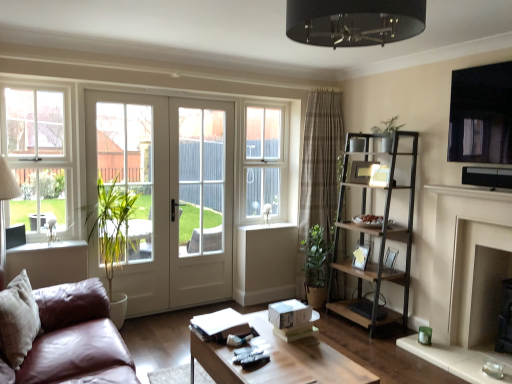
What are the coordinates of `matte black tv at upper right` in the screenshot? It's located at (481, 114).

This screenshot has height=384, width=512. Describe the element at coordinates (262, 161) in the screenshot. I see `white wood window at center, the 1th window when ordered from right to left` at that location.

Describe the element at coordinates (390, 258) in the screenshot. I see `matte black picture frame at right` at that location.

Measure the distance between matte black picture frame at right and camera.

matte black picture frame at right and camera are 3.85 meters apart.

The width and height of the screenshot is (512, 384). What do you see at coordinates (168, 194) in the screenshot?
I see `white glossy door at center` at bounding box center [168, 194].

This screenshot has height=384, width=512. I want to click on brown textured curtain at center, so click(320, 162).

From a real-world perspective, between brown textured curtain at center and matte black picture frame at right, who is vertically higher?

brown textured curtain at center.

Is brown textured curtain at center positioned with its back to matte black picture frame at right?

No.

Looking at the image, does brown textured curtain at center seem bigger or smaller compared to matte black picture frame at right?

In the image, brown textured curtain at center appears to be larger than matte black picture frame at right.

How far apart are brown textured curtain at center and matte black picture frame at right?

They are 3.54 feet apart.

Can you tell me how much matte black picture frame at right and brown textured curtain at center differ in facing direction?

The angle between the facing direction of matte black picture frame at right and the facing direction of brown textured curtain at center is 103 degrees.

Does matte black picture frame at right appear on the right side of brown textured curtain at center?

Yes.

Is point (383, 265) closer or farther from the camera than point (308, 184)?

Point (383, 265) appears to be closer to the viewer than point (308, 184).

From the picture: From the image's perspective, which is below, matte black picture frame at right or brown textured curtain at center?

matte black picture frame at right appears lower in the image.

Considering the relative sizes of green matte plant at upper right and matte black tv at upper right in the image provided, is green matte plant at upper right wider than matte black tv at upper right?

Yes.

Considering the positions of objects green matte plant at upper right and matte black tv at upper right in the image provided, who is in front, green matte plant at upper right or matte black tv at upper right?

matte black tv at upper right is more forward.

In the scene shown: Which of these two, green matte plant at upper right or matte black tv at upper right, is smaller?

green matte plant at upper right is smaller.

From the picture: Is wooden coffee table at center aimed at white wood window at center, marked as the 2th window in a front-to-back arrangement?

No, wooden coffee table at center is not oriented towards white wood window at center, marked as the 2th window in a front-to-back arrangement.

Is wooden coffee table at center smaller than white wood window at center, marked as the first window in a back-to-front arrangement?

Incorrect, wooden coffee table at center is not smaller in size than white wood window at center, marked as the first window in a back-to-front arrangement.

What are the coordinates of `the 2nd window behind the wooden coffee table at center, counting from the anchor's position` in the screenshot? It's located at (262, 161).

Does white glossy door at center have a lesser height compared to white wood window at center, marked as the 2th window in a front-to-back arrangement?

No, white glossy door at center is not shorter than white wood window at center, marked as the 2th window in a front-to-back arrangement.

Is white glossy door at center not within white wood window at center, marked as the first window in a back-to-front arrangement?

Yes, white glossy door at center is not within white wood window at center, marked as the first window in a back-to-front arrangement.

This screenshot has height=384, width=512. In order to click on door below the white wood window at center, which ranks as the 2th window in left-to-right order (from the image's perspective) in this screenshot , I will do `click(168, 194)`.

Considering the sizes of objects white wood window at center, the 1th window when ordered from right to left, and white matte fireplace at right in the image provided, who is thinner, white wood window at center, the 1th window when ordered from right to left, or white matte fireplace at right?

white matte fireplace at right.

Is white wood window at center, marked as the first window in a back-to-front arrangement, oriented towards white matte fireplace at right?

Yes, white wood window at center, marked as the first window in a back-to-front arrangement, is oriented towards white matte fireplace at right.

Does white wood window at center, marked as the first window in a back-to-front arrangement, have a lesser height compared to white matte fireplace at right?

Incorrect, the height of white wood window at center, marked as the first window in a back-to-front arrangement, does not fall short of that of white matte fireplace at right.

From a real-world perspective, is white wood window at center, which ranks as the 2th window in left-to-right order, physically below white matte fireplace at right?

No, from a real-world perspective, white wood window at center, which ranks as the 2th window in left-to-right order, is not below white matte fireplace at right.

The width and height of the screenshot is (512, 384). What are the coordinates of `picture frame that appears in front of the white glossy screen door at center` in the screenshot? It's located at (390, 258).

Could you tell me if matte black picture frame at right is turned towards white glossy screen door at center?

No, matte black picture frame at right is not facing towards white glossy screen door at center.

From the picture: Would you say matte black picture frame at right is outside white glossy screen door at center?

Yes, matte black picture frame at right is outside of white glossy screen door at center.

Between matte black picture frame at right and white glossy screen door at center, which one appears on the right side from the viewer's perspective?

Positioned to the right is matte black picture frame at right.

This screenshot has width=512, height=384. In order to click on picture frame below the brown textured curtain at center (from the image's perspective) in this screenshot , I will do `click(390, 258)`.

I want to click on curtain lying behind the matte black picture frame at right, so click(x=320, y=162).

Based on their spatial positions, is wooden coffee table at center or green matte plant at upper right closer to matte black tv at upper right?

green matte plant at upper right.

Considering their positions, is matte black tv at upper right positioned closer to white glossy door at center than beige fabric pillow at lower left?

beige fabric pillow at lower left is positioned closer to the anchor white glossy door at center.

When comparing their distances from white matte fireplace at right, does matte black tv at upper right or brown wood/black metal shelf at right seem closer?

The object closer to white matte fireplace at right is brown wood/black metal shelf at right.

Looking at the image, which one is located closer to white glossy screen door at center, brown textured curtain at center or matte black tv at upper right?

Among the two, brown textured curtain at center is located nearer to white glossy screen door at center.

Estimate the real-world distances between objects in this image. Which object is further from green matte plant at upper right, brown wood/black metal shelf at right or white glossy screen door at center?

white glossy screen door at center lies further to green matte plant at upper right than the other object.

Which object lies nearer to the anchor point green matte plant at upper right, white glossy door at center or white glossy screen door at center?

white glossy screen door at center is closer to green matte plant at upper right.

Estimate the real-world distances between objects in this image. Which object is further from matte black tv at upper right, beige fabric pillow at lower left or white glossy screen door at center?

beige fabric pillow at lower left.

Which object lies further to the anchor point green matte plant at upper right, white wood window at upper left, which is the first window from front to back, or beige fabric pillow at lower left?

beige fabric pillow at lower left lies further to green matte plant at upper right than the other object.

You are a GUI agent. You are given a task and a screenshot of the screen. Output one action in this format:
    pyautogui.click(x=<x>, y=<y>)
    Task: Click on the curtain between white matte fireplace at right and white wood window at center, the 1th window when ordered from right to left, from front to back
    
    Given the screenshot: What is the action you would take?
    click(x=320, y=162)

The image size is (512, 384). I want to click on fireplace situated between beige fabric pillow at lower left and matte black tv at upper right from left to right, so click(x=478, y=281).

In order to click on window between white wood window at upper left, the second window in the right-to-left sequence, and matte black picture frame at right, in the horizontal direction in this screenshot , I will do `click(262, 161)`.

Image resolution: width=512 pixels, height=384 pixels. I want to click on fireplace located between wooden coffee table at center and green matte plant at upper right in the depth direction, so click(x=478, y=281).